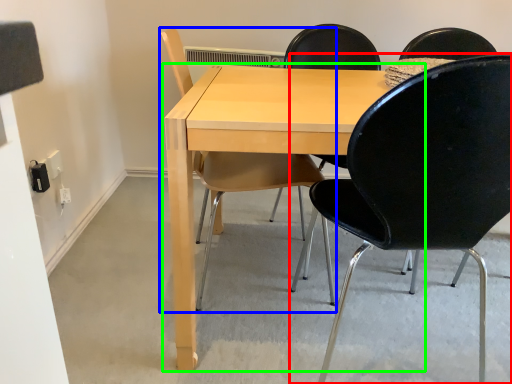
Question: Which object is positioned farthest from chair (highlighted by a red box)? Select from chair (highlighted by a blue box) and table (highlighted by a green box).

Choices:
 (A) chair
 (B) table

Answer: (A)